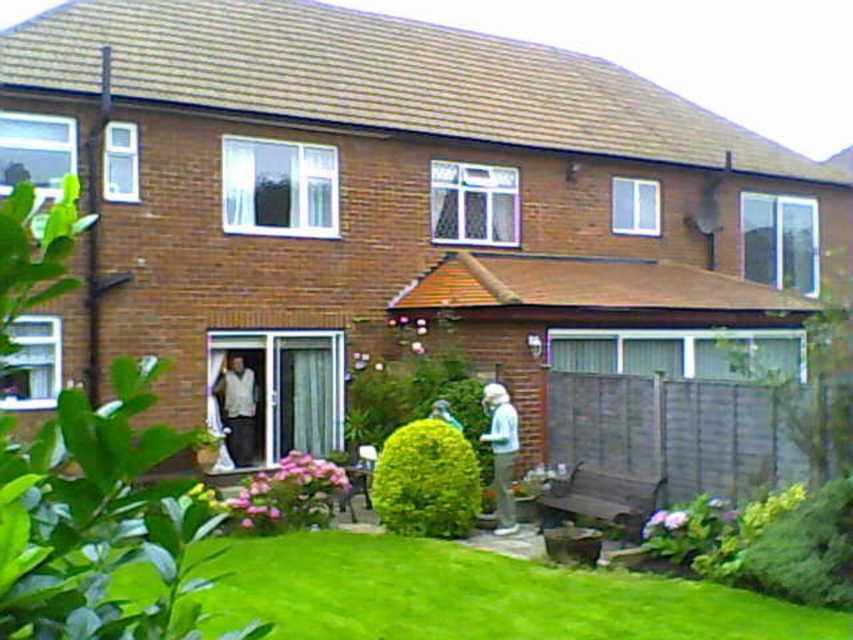
Describe the element at coordinates (474, 595) in the screenshot. I see `green grass at lower center` at that location.

Does green grass at lower center have a larger size compared to light blue fabric at lower center?

No.

Image resolution: width=853 pixels, height=640 pixels. Identify the location of green grass at lower center. (474, 595).

Can you confirm if green leafy bush at center is positioned to the right of light blue fabric jacket at lower center?

In fact, green leafy bush at center is to the left of light blue fabric jacket at lower center.

At what (x,y) coordinates should I click in order to perform the action: click on green leafy bush at center. Please return your answer as a coordinate pair (x, y). This screenshot has width=853, height=640. Looking at the image, I should click on (426, 481).

The height and width of the screenshot is (640, 853). In order to click on green leafy bush at center in this screenshot , I will do `click(426, 481)`.

Measure the distance between point [409,442] and camera.

Point [409,442] and camera are 11.65 meters apart.

Who is higher up, green leafy bush at center or white fabric coat at center?

white fabric coat at center is higher up.

Which is behind, point (427, 422) or point (231, 456)?

The point (231, 456) is behind.

Where is `green leafy bush at center`? The width and height of the screenshot is (853, 640). green leafy bush at center is located at coordinates (426, 481).